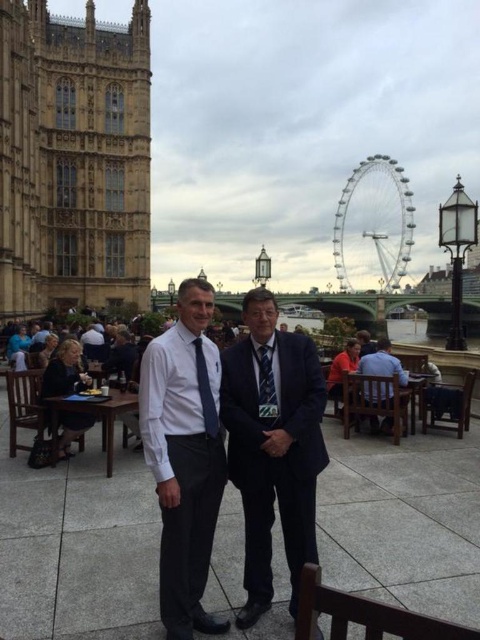
Question: Which object is the farthest from the white shirt at center?

Choices:
 (A) blue shirt at lower right
 (B) patterned silk tie at center
 (C) blue silk tie at center

Answer: (A)

Question: Does dark blue suit at center have a lesser width compared to white shirt at center?

Choices:
 (A) yes
 (B) no

Answer: (B)

Question: Does blue shirt at lower right lie in front of blue silk tie at center?

Choices:
 (A) no
 (B) yes

Answer: (A)

Question: Which of the following is the farthest from the observer?

Choices:
 (A) (265, 348)
 (B) (179, 529)

Answer: (A)

Question: Does golden stone tower at left appear on the right side of blue silk tie at center?

Choices:
 (A) no
 (B) yes

Answer: (A)

Question: Which point is closer to the camera taking this photo?

Choices:
 (A) (385, 339)
 (B) (96, 128)
 (C) (264, 396)

Answer: (C)